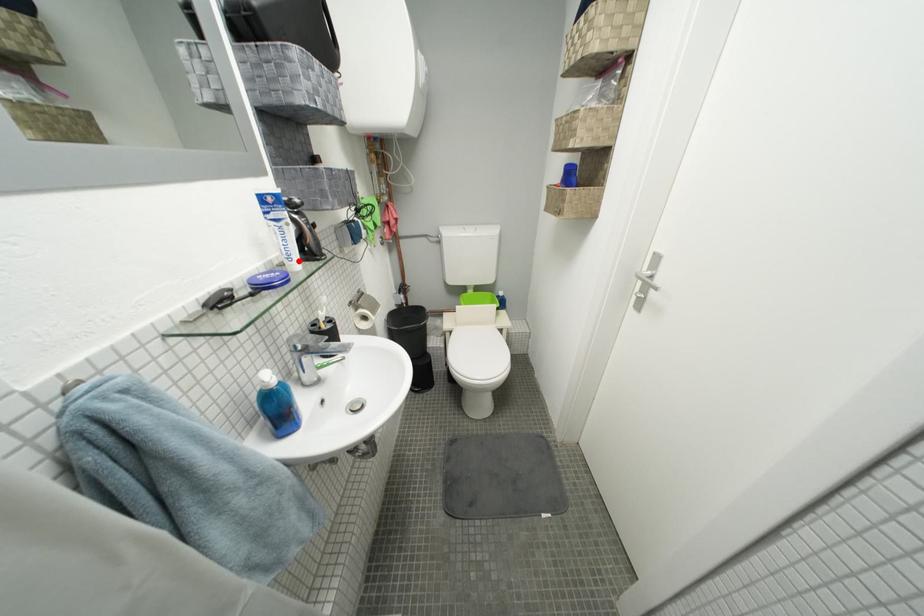
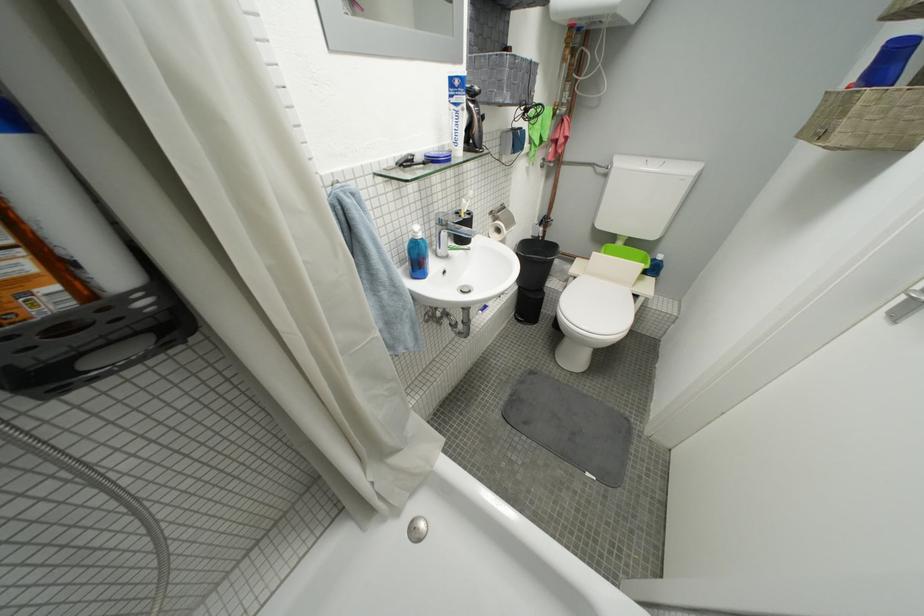
Locate, in the second image, the point that corresponds to the highlighted location in the first image.

(465, 145)